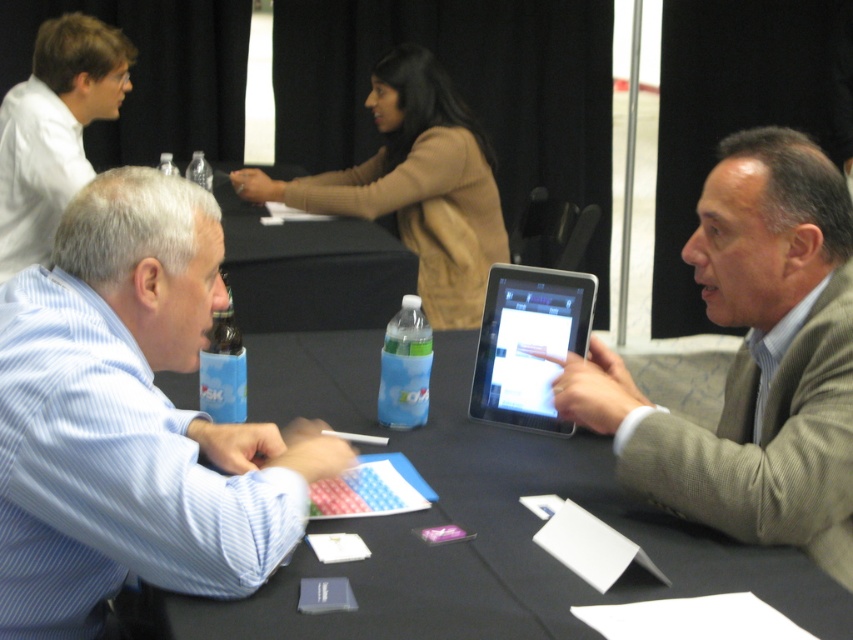
Which is below, blue fabric table at center or black glossy tablet at center?

black glossy tablet at center is lower down.

Is point (378, 273) positioned in front of point (518, 356)?

No, (378, 273) is behind (518, 356).

Where is `blue fabric table at center`? The width and height of the screenshot is (853, 640). blue fabric table at center is located at coordinates (309, 269).

How distant is black fabric table at center from tan sweater at upper center?

The distance of black fabric table at center from tan sweater at upper center is 4.07 feet.

Can you confirm if black fabric table at center is bigger than tan sweater at upper center?

No.

The image size is (853, 640). What do you see at coordinates (474, 522) in the screenshot?
I see `black fabric table at center` at bounding box center [474, 522].

Where is `black fabric table at center`? black fabric table at center is located at coordinates (474, 522).

Who is taller, white shirt at upper left or black glossy tablet at center?

With more height is white shirt at upper left.

Find the location of `white shirt at upper left`. white shirt at upper left is located at coordinates (54, 131).

Locate an element on the screen. The image size is (853, 640). white shirt at upper left is located at coordinates (54, 131).